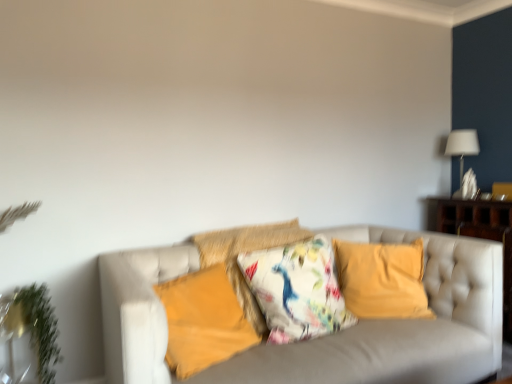
Question: Considering the relative positions of matte yellow pillow at center, positioned as the 1th pillow in left-to-right order, and floral fabric cushion at center, which ranks as the third pillow in left-to-right order, in the image provided, is matte yellow pillow at center, positioned as the 1th pillow in left-to-right order, to the left or to the right of floral fabric cushion at center, which ranks as the third pillow in left-to-right order,?

Choices:
 (A) right
 (B) left

Answer: (B)

Question: In terms of size, does matte yellow pillow at center, which ranks as the fourth pillow in right-to-left order, appear bigger or smaller than floral fabric cushion at center, acting as the 2th pillow starting from the right?

Choices:
 (A) small
 (B) big

Answer: (A)

Question: Which object is positioned farthest from the floral fabric cushion at center, acting as the 2th pillow starting from the right?

Choices:
 (A) velvet yellow pillow at center, acting as the fourth pillow starting from the left
 (B) matte yellow pillow at center, which ranks as the fourth pillow in right-to-left order
 (C) floral fabric cushion at center, which is the third pillow in right-to-left order
 (D) white fabric lampshade at upper right
 (E) green leafy plant at left

Answer: (D)

Question: Which of these objects is positioned closest to the green leafy plant at left?

Choices:
 (A) wooden dresser at right
 (B) white fabric lampshade at upper right
 (C) velvet yellow pillow at center, acting as the 1th pillow starting from the right
 (D) floral fabric cushion at center, which is the third pillow in right-to-left order
 (E) floral fabric cushion at center, acting as the 2th pillow starting from the right

Answer: (D)